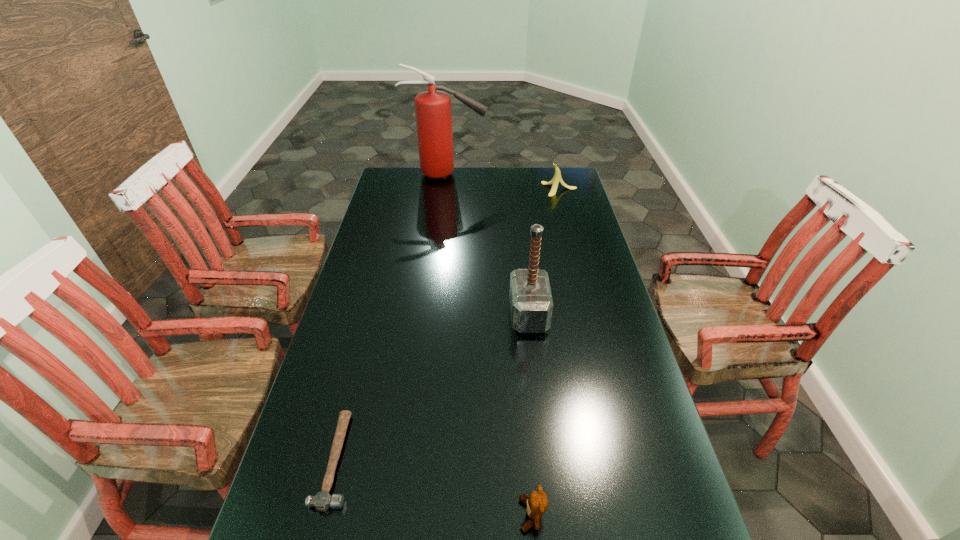
What are the coordinates of `unoccupied area between the tallest object and the right hammer` in the screenshot? It's located at (488, 245).

Find the location of `unoccupied area between the shorter hammer and the farther hammer`. unoccupied area between the shorter hammer and the farther hammer is located at coordinates (433, 387).

What are the coordinates of `vacant region between the teddy bear and the shorter hammer` in the screenshot? It's located at (434, 487).

Find the location of a particular element. The image size is (960, 540). empty location between the right hammer and the teddy bear is located at coordinates (530, 415).

Identify the location of empty space that is in between the third shortest object and the farther hammer. (544, 252).

Where is `object that is the third nearest to the tallest object`? The image size is (960, 540). object that is the third nearest to the tallest object is located at coordinates coord(322,501).

The height and width of the screenshot is (540, 960). Identify the location of object that is the closest to the tallest object. (557, 178).

The height and width of the screenshot is (540, 960). What are the coordinates of `blank area in the image that satisfies the following two spatial constraints: 1. at the nozzle of the third tallest object; 2. on the left side of the tallest object` in the screenshot? It's located at (444, 189).

In order to click on free space that satisfies the following two spatial constraints: 1. on the back side of the third tallest object; 2. on the right side of the taller hammer in this screenshot , I will do `click(515, 189)`.

Image resolution: width=960 pixels, height=540 pixels. In order to click on vacant area in the image that satisfies the following two spatial constraints: 1. at the nozzle of the tallest object; 2. on the right side of the taller hammer in this screenshot , I will do `click(430, 315)`.